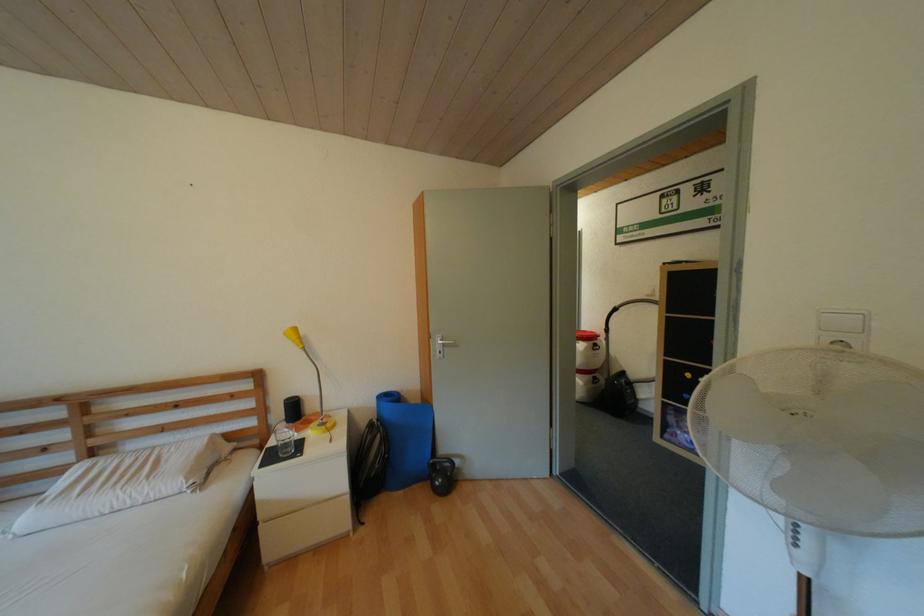
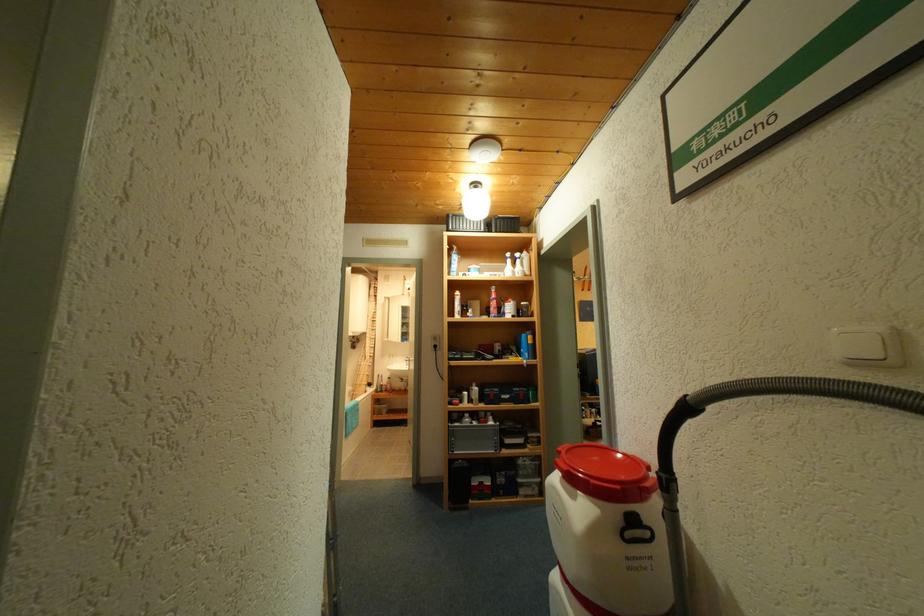
Looking at this image, the images are taken continuously from a first-person perspective. In which direction are you moving?

The cameraman moved toward right, forward.